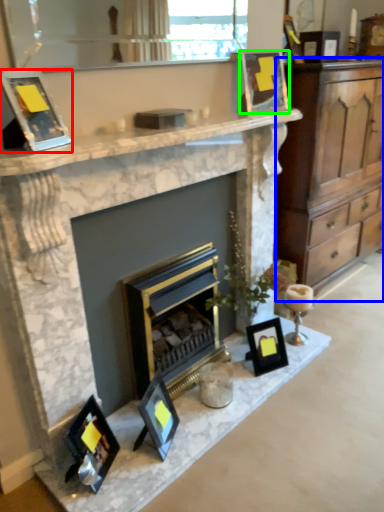
Question: Considering the real-world distances, which object is closest to picture frame (highlighted by a red box)? cabinetry (highlighted by a blue box) or picture frame (highlighted by a green box).

Choices:
 (A) cabinetry
 (B) picture frame

Answer: (B)